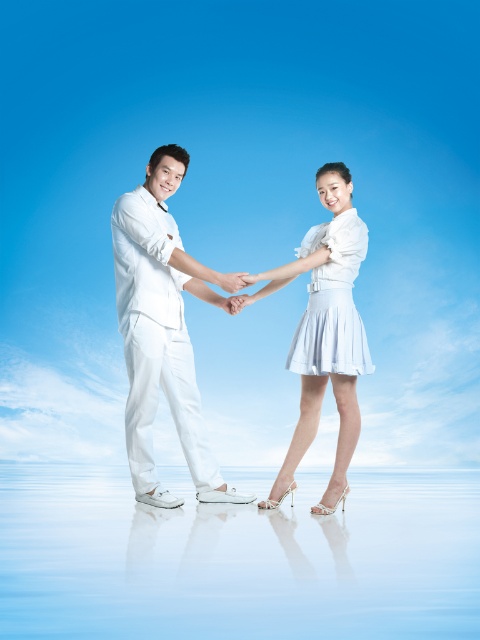
Question: Estimate the real-world distances between objects in this image. Which object is farther from the white glossy water at center?

Choices:
 (A) white satin dress at center
 (B) white matte suit at center
 (C) white satin skirt at center

Answer: (A)

Question: Observing the image, what is the correct spatial positioning of white matte suit at center in reference to white satin dress at center?

Choices:
 (A) right
 (B) left

Answer: (B)

Question: Estimate the real-world distances between objects in this image. Which object is closer to the white glossy water at center?

Choices:
 (A) white matte suit at center
 (B) white satin dress at center

Answer: (A)

Question: Considering the real-world distances, which object is farthest from the white satin dress at center?

Choices:
 (A) white glossy water at center
 (B) white satin skirt at center

Answer: (A)

Question: Can you confirm if white matte suit at center is positioned above white satin dress at center?

Choices:
 (A) yes
 (B) no

Answer: (B)

Question: Does white satin skirt at center appear on the right side of white satin dress at center?

Choices:
 (A) yes
 (B) no

Answer: (B)